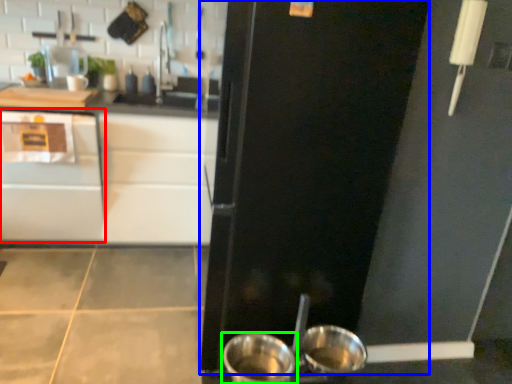
Question: Considering the real-world distances, which object is farthest from cabinetry (highlighted by a red box)? door (highlighted by a blue box) or kitchen appliance (highlighted by a green box)?

Choices:
 (A) door
 (B) kitchen appliance

Answer: (B)